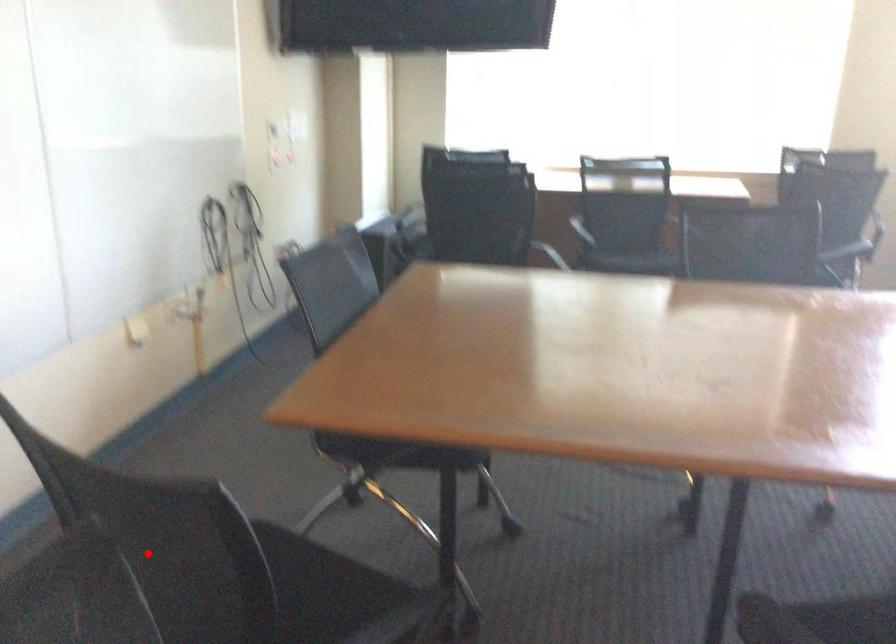
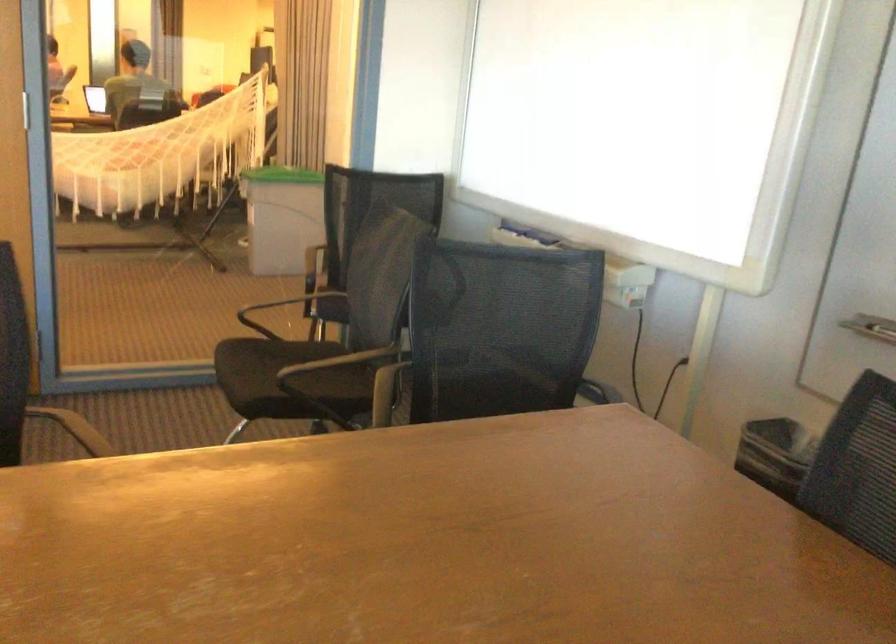
Find the pixel in the second image that matches the highlighted location in the first image.

(501, 328)